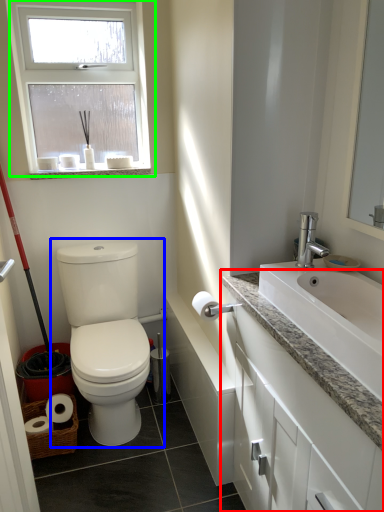
Question: Based on their relative distances, which object is farther from bathroom cabinet (highlighted by a red box)? Choose from toilet (highlighted by a blue box) and window (highlighted by a green box).

Choices:
 (A) toilet
 (B) window

Answer: (B)